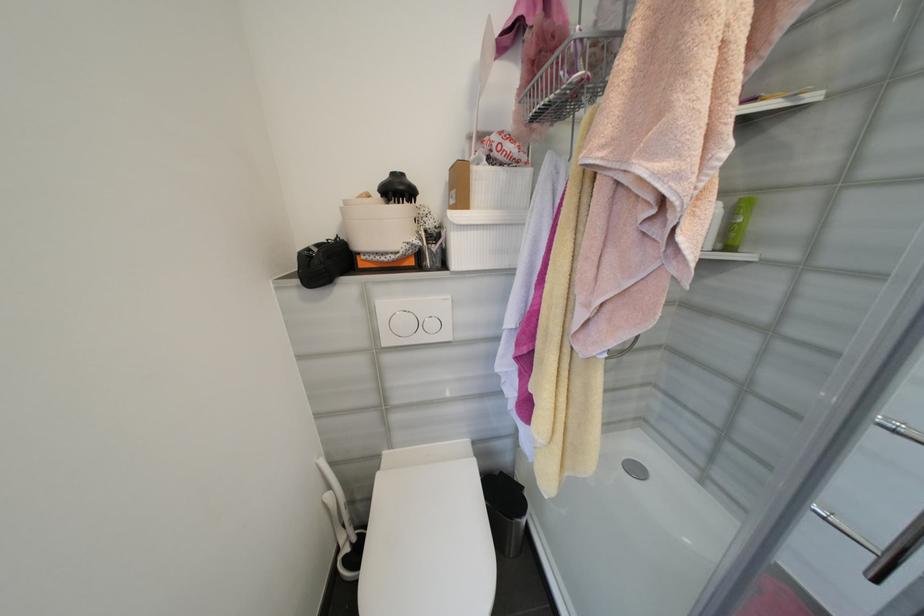
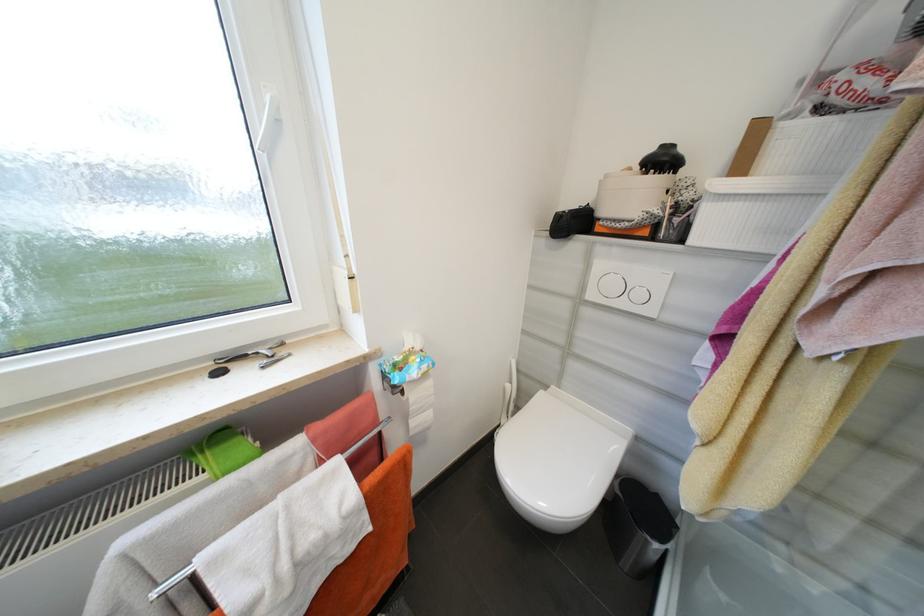
The point at (311, 260) is marked in the first image. Where is the corresponding point in the second image?

(565, 217)